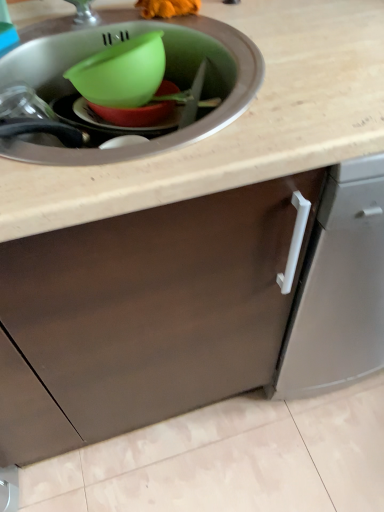
Question: Is green plastic bowl at center not close to matte green plastic sink at upper left?

Choices:
 (A) no
 (B) yes

Answer: (A)

Question: Considering the relative sizes of green plastic bowl at center and matte green plastic sink at upper left in the image provided, is green plastic bowl at center smaller than matte green plastic sink at upper left?

Choices:
 (A) yes
 (B) no

Answer: (A)

Question: Is green plastic bowl at center located outside matte green plastic sink at upper left?

Choices:
 (A) yes
 (B) no

Answer: (B)

Question: Is green plastic bowl at center touching matte green plastic sink at upper left?

Choices:
 (A) no
 (B) yes

Answer: (A)

Question: Can you confirm if green plastic bowl at center is wider than matte green plastic sink at upper left?

Choices:
 (A) yes
 (B) no

Answer: (B)

Question: From a real-world perspective, is green plastic bowl at center beneath matte green plastic sink at upper left?

Choices:
 (A) no
 (B) yes

Answer: (B)

Question: Is the depth of matte green plastic sink at upper left greater than that of green plastic bowl at center?

Choices:
 (A) no
 (B) yes

Answer: (A)

Question: Considering the relative positions of matte green plastic sink at upper left and green plastic bowl at center in the image provided, is matte green plastic sink at upper left to the left of green plastic bowl at center from the viewer's perspective?

Choices:
 (A) yes
 (B) no

Answer: (A)

Question: Is matte green plastic sink at upper left positioned beyond the bounds of green plastic bowl at center?

Choices:
 (A) yes
 (B) no

Answer: (A)

Question: Considering the relative sizes of matte green plastic sink at upper left and green plastic bowl at center in the image provided, is matte green plastic sink at upper left smaller than green plastic bowl at center?

Choices:
 (A) no
 (B) yes

Answer: (A)

Question: Can you confirm if matte green plastic sink at upper left is taller than green plastic bowl at center?

Choices:
 (A) no
 (B) yes

Answer: (B)

Question: Is matte green plastic sink at upper left thinner than green plastic bowl at center?

Choices:
 (A) no
 (B) yes

Answer: (A)

Question: Considering the positions of green plastic bowl at center and matte green plastic sink at upper left in the image, is green plastic bowl at center taller or shorter than matte green plastic sink at upper left?

Choices:
 (A) short
 (B) tall

Answer: (A)